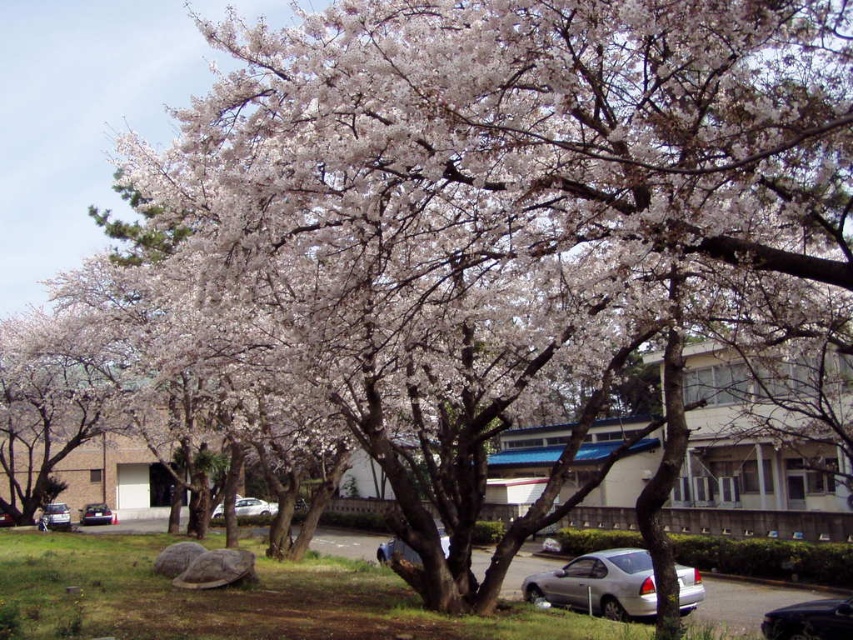
You are a photographer trying to capture the white matte flower at upper center and the silver metallic car at center in the same frame. Which object should you focus on first if you want to ensure both are in focus without adjusting your camera settings?

The white matte flower at upper center should be focused on first because it is larger in size compared to the silver metallic car at center, allowing for better depth of field coverage.

You are standing in the parking area in front of the modern building with light colored walls and blue accents. You see a point marked at coordinates (9, 208). If you want to walk towards that point, how far will you have to walk?

The point at (9, 208) is 48.10 meters away from the viewer, so you will have to walk 48.10 meters to reach it.